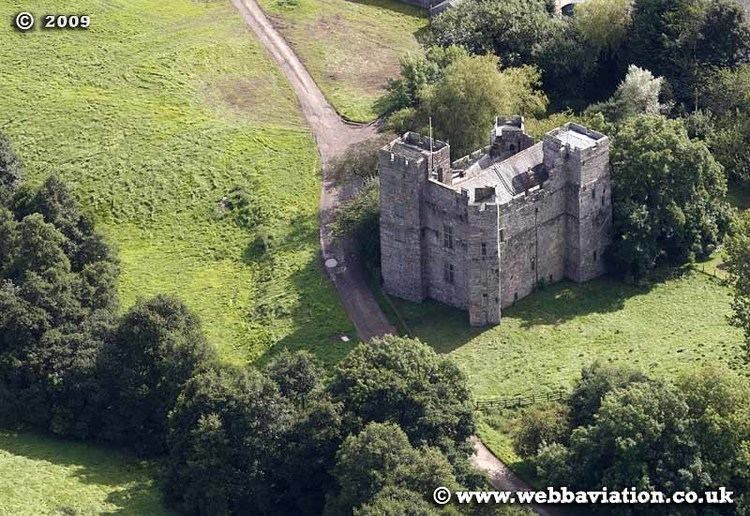
Where is `windows`? The height and width of the screenshot is (516, 750). windows is located at coordinates (446, 240), (448, 272), (483, 245), (484, 298), (501, 233), (531, 259), (595, 254), (594, 193), (552, 278), (517, 294).